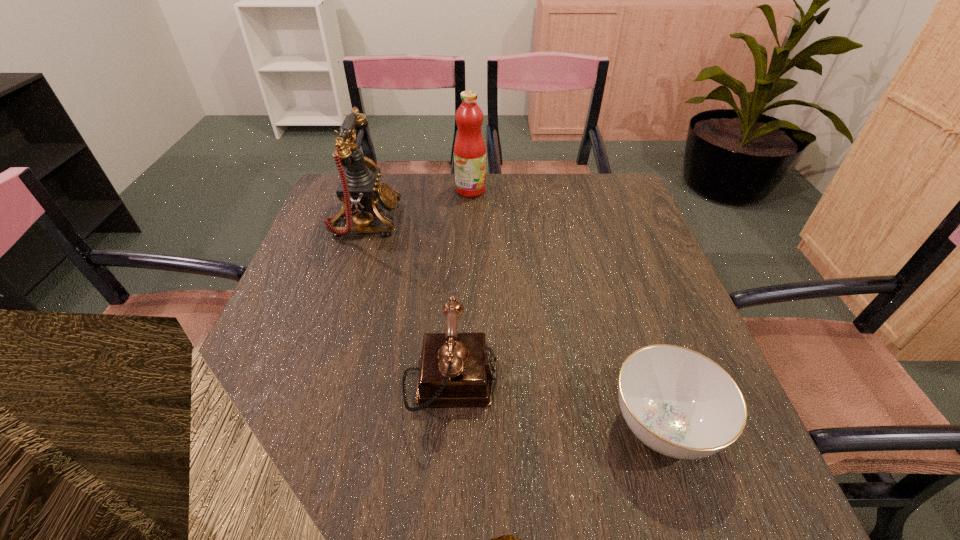
Find the location of `vacant space at the left edge of the desktop`. vacant space at the left edge of the desktop is located at coordinates (309, 345).

Where is `vacant point at the right edge`? vacant point at the right edge is located at coordinates (639, 227).

Where is `free region at the far right corner of the desktop`? The height and width of the screenshot is (540, 960). free region at the far right corner of the desktop is located at coordinates (618, 206).

At what (x,y) coordinates should I click in order to perform the action: click on vacant area that lies between the second shortest object and the rightmost object. Please return your answer as a coordinate pair (x, y). This screenshot has width=960, height=540. Looking at the image, I should click on (557, 404).

Locate an element on the screen. The image size is (960, 540). free spot between the leftmost object and the shorter telephone is located at coordinates (408, 301).

The width and height of the screenshot is (960, 540). What are the coordinates of `empty location between the nearer telephone and the fruit juice` in the screenshot? It's located at (461, 286).

What are the coordinates of `vacant space in between the left telephone and the right telephone` in the screenshot? It's located at (408, 301).

Identify the location of free space between the rightmost object and the nearer telephone. The image size is (960, 540). (557, 404).

This screenshot has height=540, width=960. Identify the location of free space between the right telephone and the rightmost object. (557, 404).

The width and height of the screenshot is (960, 540). In order to click on empty location between the fruit juice and the rightmost object in this screenshot , I will do `click(566, 308)`.